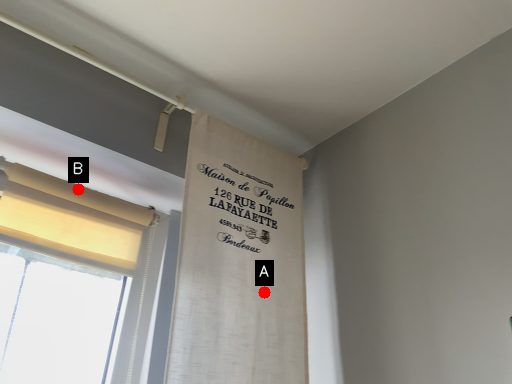
Question: Two points are circled on the image, labeled by A and B beside each circle. Which point is farther to the camera?

Choices:
 (A) A is further
 (B) B is further

Answer: (A)